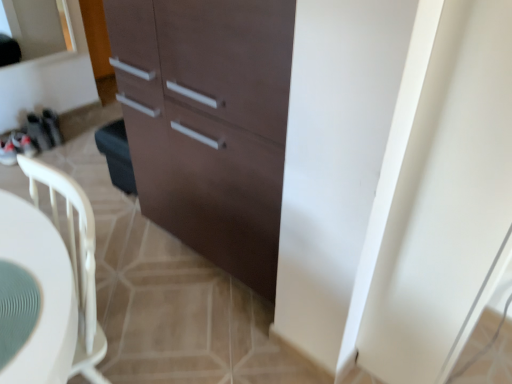
Question: Is teal textured placemat at lower left completely or partially inside matte brown cabinet at center?

Choices:
 (A) yes
 (B) no

Answer: (B)

Question: Would you say matte brown cabinet at center is outside teal textured placemat at lower left?

Choices:
 (A) yes
 (B) no

Answer: (A)

Question: Does matte brown cabinet at center appear on the left side of teal textured placemat at lower left?

Choices:
 (A) yes
 (B) no

Answer: (B)

Question: From a real-world perspective, is matte brown cabinet at center positioned under teal textured placemat at lower left based on gravity?

Choices:
 (A) no
 (B) yes

Answer: (B)

Question: Considering the relative positions of matte brown cabinet at center and teal textured placemat at lower left in the image provided, is matte brown cabinet at center behind teal textured placemat at lower left?

Choices:
 (A) no
 (B) yes

Answer: (B)

Question: Is matte brown cabinet at center closer to the viewer compared to teal textured placemat at lower left?

Choices:
 (A) no
 (B) yes

Answer: (A)

Question: Is white glossy screen door at right directly adjacent to matte brown cabinet at center?

Choices:
 (A) no
 (B) yes

Answer: (A)

Question: Considering the relative positions of white glossy screen door at right and matte brown cabinet at center in the image provided, is white glossy screen door at right behind matte brown cabinet at center?

Choices:
 (A) yes
 (B) no

Answer: (B)

Question: Is white glossy screen door at right to the left of matte brown cabinet at center from the viewer's perspective?

Choices:
 (A) yes
 (B) no

Answer: (B)

Question: Considering the relative sizes of white glossy screen door at right and matte brown cabinet at center in the image provided, is white glossy screen door at right smaller than matte brown cabinet at center?

Choices:
 (A) yes
 (B) no

Answer: (A)

Question: Could you tell me if white glossy screen door at right is turned towards matte brown cabinet at center?

Choices:
 (A) yes
 (B) no

Answer: (A)

Question: Is white glossy screen door at right far away from matte brown cabinet at center?

Choices:
 (A) no
 (B) yes

Answer: (A)

Question: Does white glossy screen door at right lie behind teal textured placemat at lower left?

Choices:
 (A) no
 (B) yes

Answer: (B)